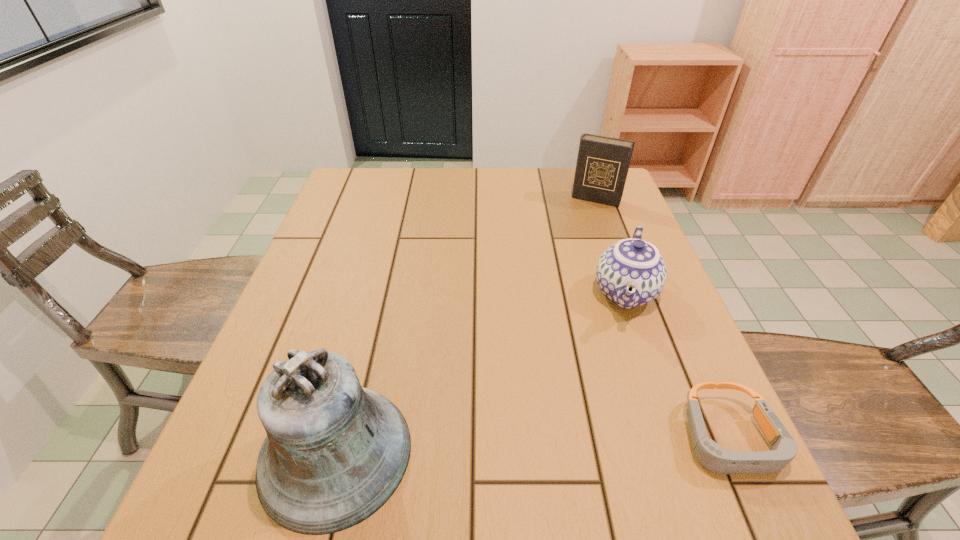
The width and height of the screenshot is (960, 540). Find the location of `vacant area that lies between the third shortest object and the goggles`. vacant area that lies between the third shortest object and the goggles is located at coordinates 662,319.

Select which object is the closest to the goggles. Please provide its 2D coordinates. Your answer should be formatted as a tuple, i.e. [(x, y)], where the tuple contains the x and y coordinates of a point satisfying the conditions above.

[(630, 273)]

Locate an element on the screen. object that is the third closest to the third tallest object is located at coordinates 335,452.

What are the coordinates of `vacant region that satisfies the following two spatial constraints: 1. on the back side of the tallest object; 2. on the right side of the second tallest object` in the screenshot? It's located at (399, 199).